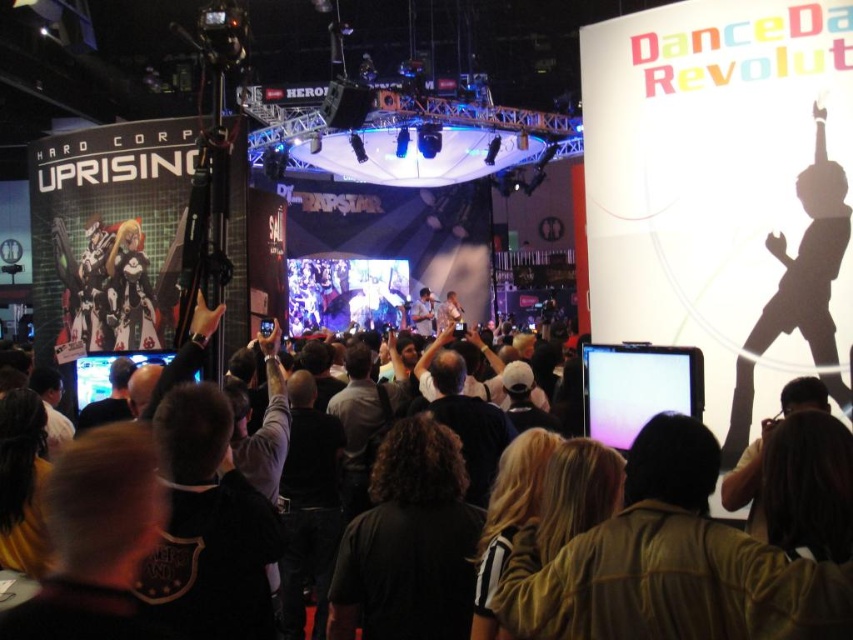
Question: Which of the following is the farthest from the observer?

Choices:
 (A) [683, 387]
 (B) [100, 392]
 (C) [294, 291]
 (D) [521, 624]

Answer: (C)

Question: Is dark clothing crowd at center to the left of matte black tablet at center from the viewer's perspective?

Choices:
 (A) no
 (B) yes

Answer: (B)

Question: Is black matte silhouette at upper right positioned before shiny silver stage at center?

Choices:
 (A) yes
 (B) no

Answer: (A)

Question: In this image, where is dark clothing crowd at center located relative to black matte silhouette at upper right?

Choices:
 (A) left
 (B) right

Answer: (A)

Question: Which point appears farthest from the camera in this image?

Choices:
 (A) (107, 388)
 (B) (651, 372)
 (C) (671, 593)
 (D) (289, 268)

Answer: (D)

Question: Among these points, which one is nearest to the camera?

Choices:
 (A) (96, 364)
 (B) (364, 317)
 (C) (747, 380)
 (D) (585, 390)

Answer: (C)